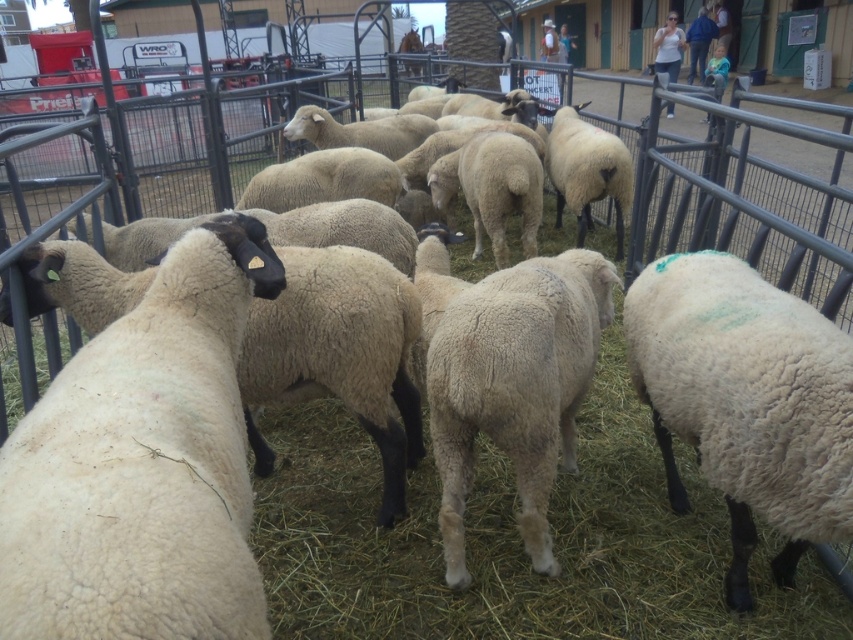
Does point (210, 528) lie in front of point (751, 305)?

Yes, point (210, 528) is closer to viewer.

Is white woolen sheep at left further to camera compared to white woolen sheep at right?

No, white woolen sheep at left is in front of white woolen sheep at right.

Is point (248, 589) more distant than point (844, 406)?

That is False.

Locate an element on the screen. The height and width of the screenshot is (640, 853). white woolen sheep at left is located at coordinates (143, 465).

Does point (83, 586) come behind point (566, 376)?

No, (83, 586) is closer to viewer.

Between white woolen sheep at left and white woolen sheep at center, which one is positioned lower?

Positioned lower is white woolen sheep at center.

Locate an element on the screen. Image resolution: width=853 pixels, height=640 pixels. white woolen sheep at left is located at coordinates click(x=143, y=465).

Between white woolen sheep at right and white woolen sheep at center, which one appears on the left side from the viewer's perspective?

Positioned to the left is white woolen sheep at center.

Does white woolen sheep at right have a lesser width compared to white woolen sheep at center?

Indeed, white woolen sheep at right has a lesser width compared to white woolen sheep at center.

The height and width of the screenshot is (640, 853). Identify the location of white woolen sheep at right. (746, 401).